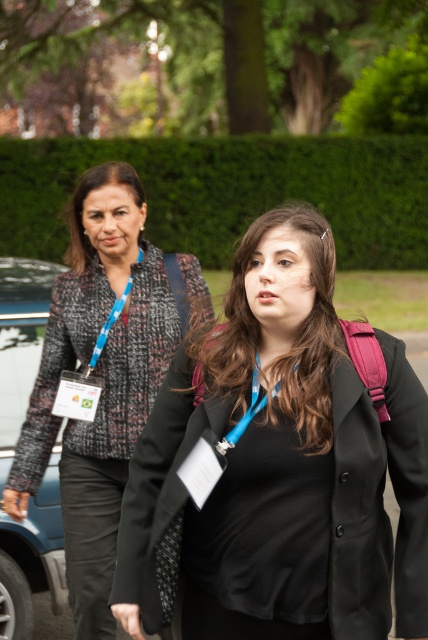
Question: Where is speckled tweed blazer at left located in relation to matte black jacket at center in the image?

Choices:
 (A) right
 (B) left

Answer: (B)

Question: Is matte black jacket at center to the right of blue fabric lanyard at upper left from the viewer's perspective?

Choices:
 (A) no
 (B) yes

Answer: (B)

Question: Can you confirm if black matte blazer at center is wider than matte black jacket at center?

Choices:
 (A) no
 (B) yes

Answer: (B)

Question: Among these points, which one is nearest to the camera?

Choices:
 (A) (270, 387)
 (B) (276, 387)

Answer: (B)

Question: Which is farther from the blue fabric lanyard at upper left?

Choices:
 (A) speckled tweed blazer at left
 (B) matte black jacket at center

Answer: (B)

Question: Estimate the real-world distances between objects in this image. Which object is closer to the speckled tweed blazer at left?

Choices:
 (A) matte black jacket at upper left
 (B) matte black jacket at center
 (C) black matte blazer at center
 (D) blue fabric lanyard at upper left

Answer: (D)